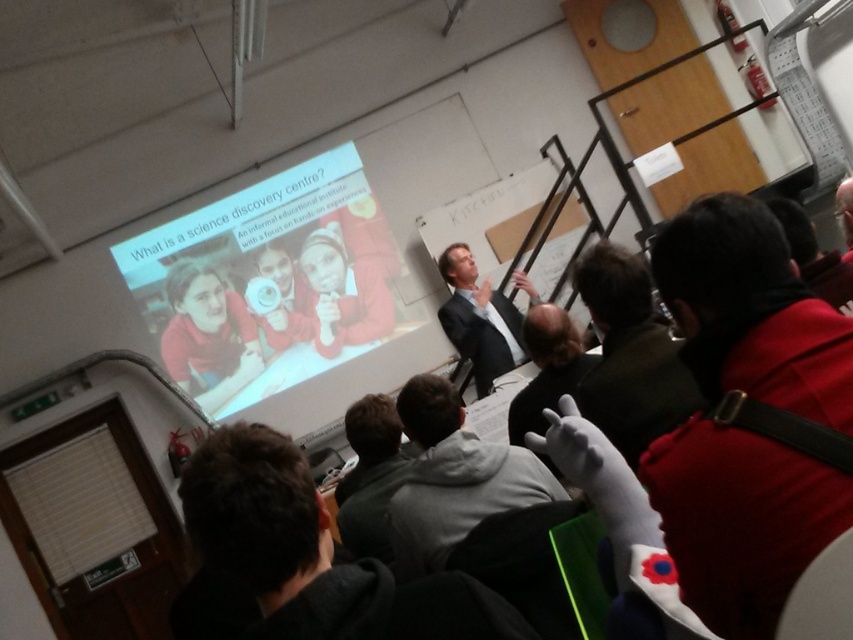
Locate an element on the screen. The height and width of the screenshot is (640, 853). dark gray hoodie at lower right is located at coordinates (630, 355).

Which is below, dark gray hoodie at lower right or matte red sweater at center?

matte red sweater at center is lower down.

Image resolution: width=853 pixels, height=640 pixels. I want to click on dark gray hoodie at lower right, so click(x=630, y=355).

Between matte red sweater at center and dark gray hoodie at center, which one is positioned lower?

dark gray hoodie at center is lower down.

Does point (183, 381) come behind point (543, 333)?

Yes, it is.

Between point (260, 353) and point (534, 337), which one is positioned behind?

Point (260, 353)

Identify the location of matte red sweater at center. The height and width of the screenshot is (640, 853). (207, 333).

Is white glossy projector screen at upper center further to camera compared to dark gray hoodie at center?

Yes, white glossy projector screen at upper center is further from the viewer.

Describe the element at coordinates (268, 282) in the screenshot. I see `white glossy projector screen at upper center` at that location.

Image resolution: width=853 pixels, height=640 pixels. Describe the element at coordinates (268, 282) in the screenshot. I see `white glossy projector screen at upper center` at that location.

Identify the location of white glossy projector screen at upper center. This screenshot has height=640, width=853. (268, 282).